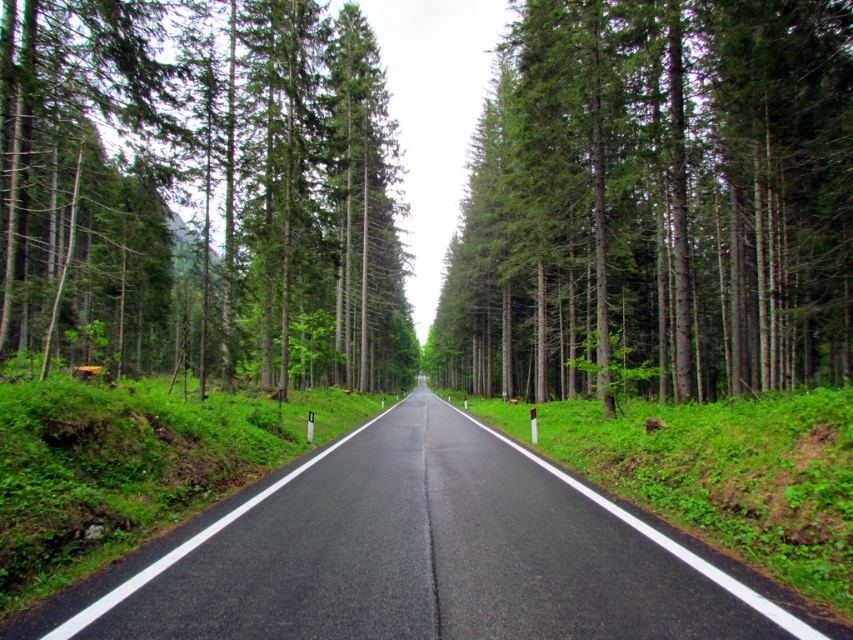
You are standing at the camera position looking down the road. If you walk straight towards the point at point (297, 80), how far will you have to walk to reach it?

The point at point (297, 80) is 31.16 meters away from the camera, so you will have to walk 31.16 meters to reach it.

You are driving a car and need to stay within the asphalt road at center. Considering the green matte tree at center is blocking your view, can you safely navigate around it?

The green matte tree at center is larger in size than the asphalt road at center, so the tree may be obstructing the road entirely. You should slow down and proceed with caution to ensure safe navigation around the tree.

You are driving a car and see the green matte tree at center and the green matte tree at left. Which tree is closer to the road?

The green matte tree at center is closer to the road because it is positioned below the green matte tree at left, indicating it is in a lower, more forward plane in the image.